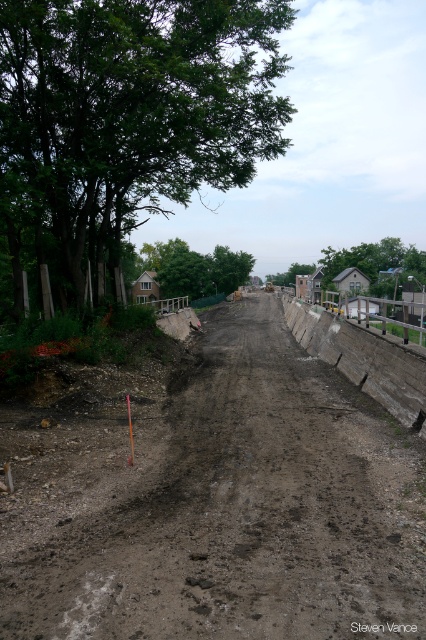
You are a delivery truck driver who needs to navigate through the construction site shown in the image. The truck requires a minimum clearance of 3.5 meters to safely pass through any path. Can you safely drive through the dull brown dirt track at center?

The dull brown dirt track at center is 4.00 meters away from the camera, which means there is sufficient clearance for the delivery truck requiring 3.5 meters. Therefore, it is safe to drive through the dull brown dirt track at center.

You are a delivery driver who needs to drive a truck with a width of 2.5 meters through the construction site. The truck must stay on the dull brown dirt track at center. Can the truck safely pass through the track without hitting the green leafy tree at upper center?

The dull brown dirt track at center has a smaller size compared to green leafy tree at upper center. Since the track is narrower than the tree, the truck should be able to pass safely as long as it stays centered on the track and maintains a safe distance from the tree.